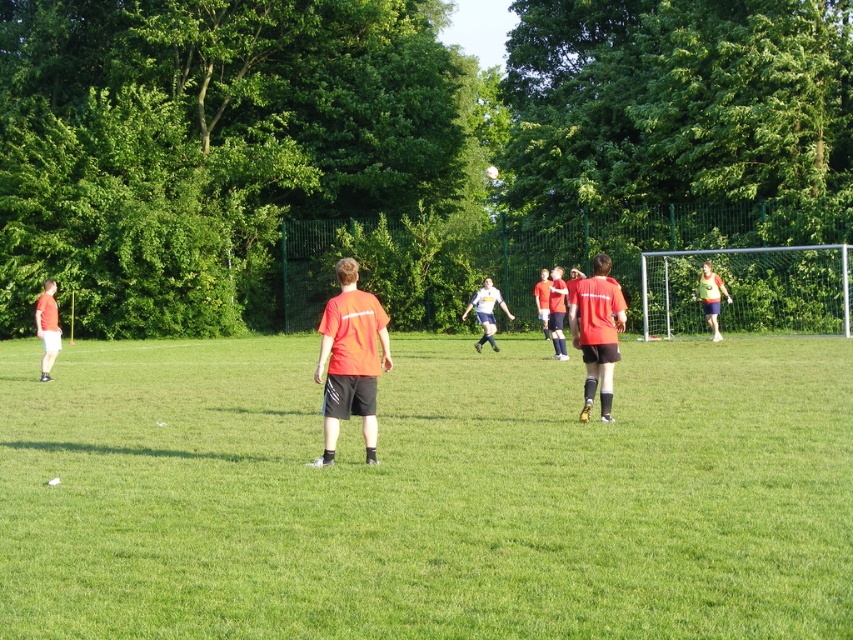
What are the coordinates of the green grass field at center?

The green grass field at center is located at coordinates point [427,493].

You are a photographer trying to capture both the orange matte shirt at center and the green matte jersey at right in a single frame. Based on their sizes in the image, which one should you focus on to ensure both are clearly visible?

The orange matte shirt at center is larger in size compared to the green matte jersey at right. To ensure both are clearly visible, focus on the orange matte shirt at center as it will occupy more space in the frame, allowing the smaller green matte jersey at right to still be visible without overcrowding the composition.